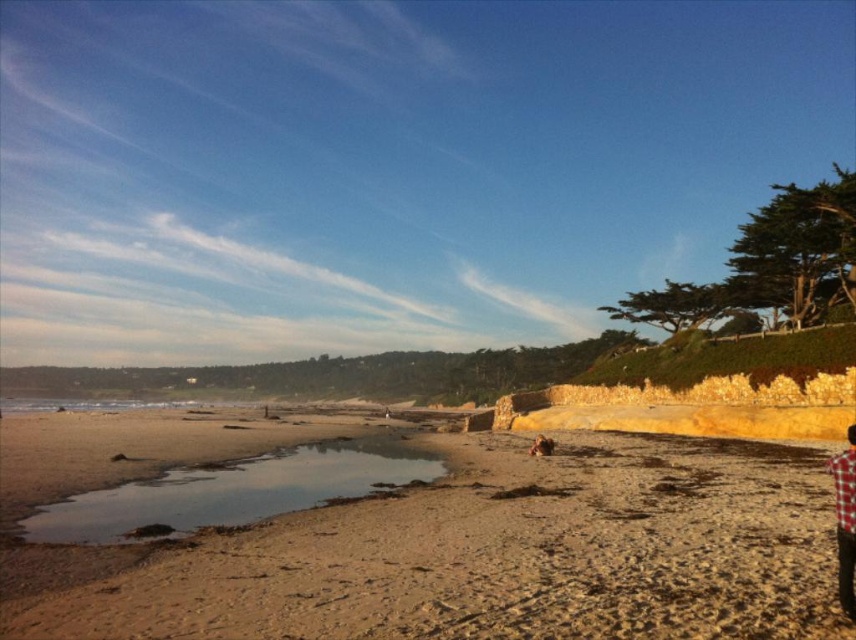
You are standing on the beach and want to place the plaid fabric shirt at lower right and the brown fur dog at center on the sand. Which object requires more space horizontally to fit on the sand?

The plaid fabric shirt at lower right requires more space horizontally because its width is larger than the brown fur dog at center.

You are standing on the brown sandy beach at lower left and want to walk to the plaid fabric shirt at lower right. Which direction should you head to reach it?

You should head towards the lower right direction to reach the plaid fabric shirt at lower right from the brown sandy beach at lower left.